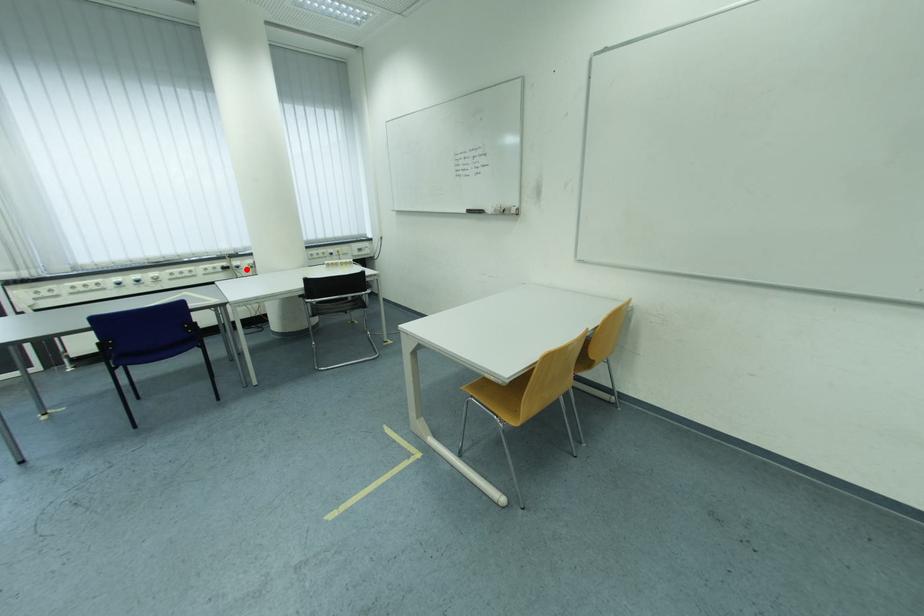
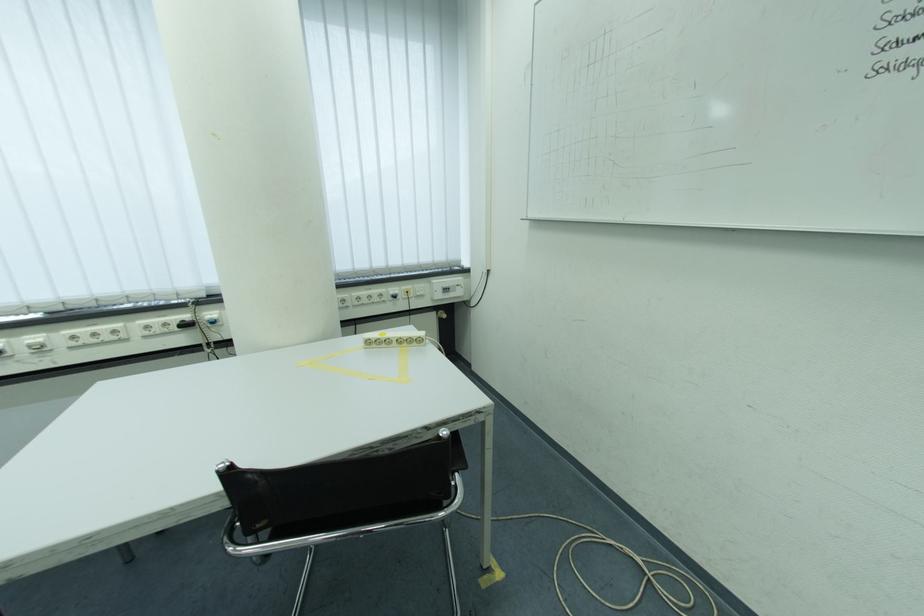
The point at the highlighted location is marked in the first image. Where is the corresponding point in the second image?

(223, 325)